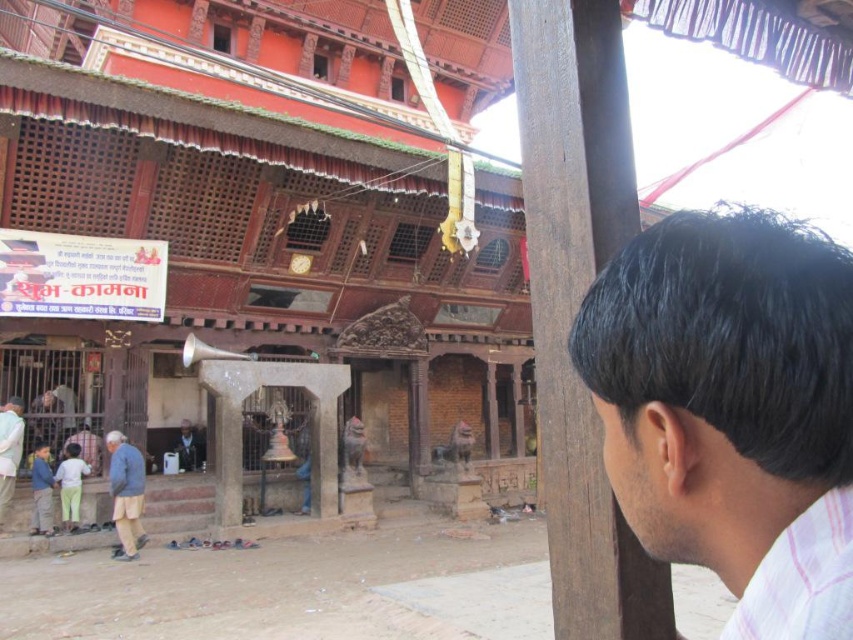
You are standing in the temple courtyard and see the blue denim jacket at lower left and the light blue fabric at lower left. Which item is closer to the ground?

The blue denim jacket at lower left is below the light blue fabric at lower left, so it is closer to the ground.

What is the location of the dark brown hair at upper right in the image coordinates?

The dark brown hair at upper right is located at point (721, 385).

You are a visitor in the temple courtyard and notice two items at the lower left corner. Which one is smaller between the blue denim jacket at lower left and the light blue fabric at lower left?

The blue denim jacket at lower left is smaller than the light blue fabric at lower left.